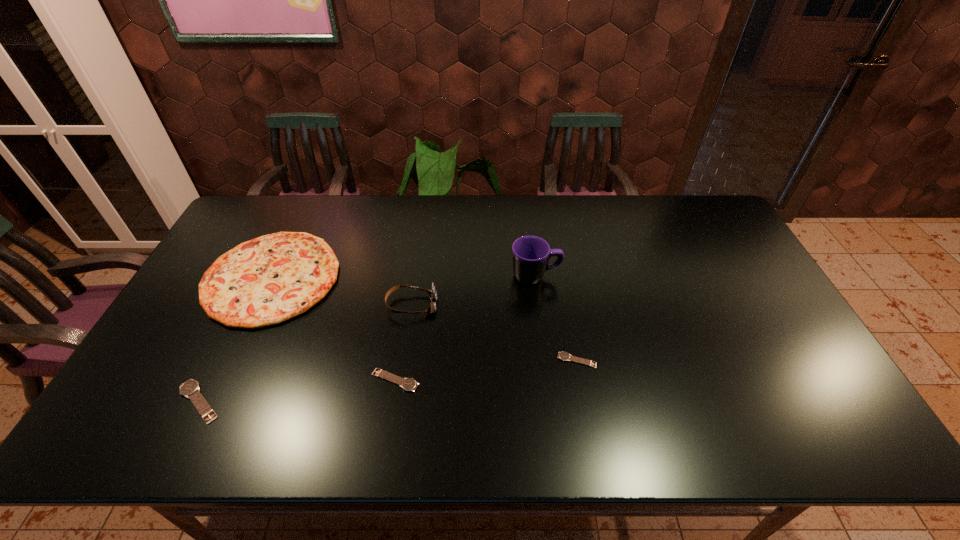
Where is `the tallest watch`? the tallest watch is located at coordinates (190, 389).

You are a GUI agent. You are given a task and a screenshot of the screen. Output one action in this format:
    pyautogui.click(x=<x>, y=<y>)
    Task: Click on the fourth tallest object
    The image size is (960, 540).
    Given the screenshot: What is the action you would take?
    pyautogui.click(x=190, y=389)

The width and height of the screenshot is (960, 540). I want to click on the second watch from right to left, so click(x=408, y=384).

This screenshot has width=960, height=540. Find the location of `the second shortest object`. the second shortest object is located at coordinates (408, 384).

Identify the location of the shortest watch. (564, 356).

Where is `the rightmost watch`? This screenshot has width=960, height=540. the rightmost watch is located at coordinates (564, 356).

The width and height of the screenshot is (960, 540). I want to click on pizza, so click(265, 281).

Identify the location of mug. This screenshot has width=960, height=540. (530, 254).

At what (x,y) coordinates should I click in order to perform the action: click on the fifth shortest object. Please return your answer as a coordinate pair (x, y). Looking at the image, I should click on (432, 293).

Where is `vacant point located 0.280m on the back of the tallest watch`? Image resolution: width=960 pixels, height=540 pixels. vacant point located 0.280m on the back of the tallest watch is located at coordinates (251, 297).